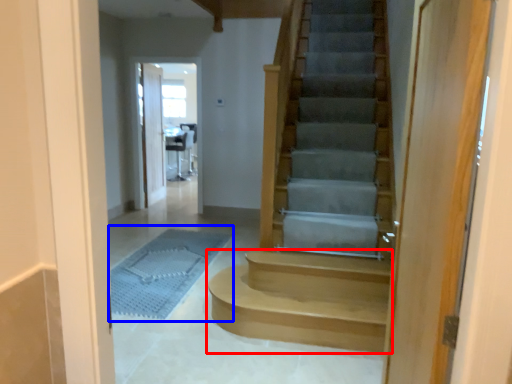
Question: Which of the following is the farthest to the observer, stairs (highlighted by a red box) or bath mat (highlighted by a blue box)?

Choices:
 (A) stairs
 (B) bath mat

Answer: (B)